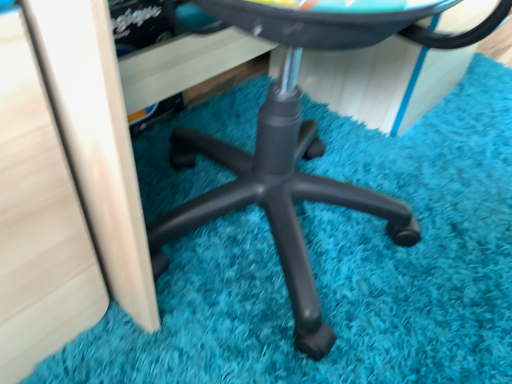
What do you see at coordinates (276, 197) in the screenshot? This screenshot has width=512, height=384. I see `black plastic chair at center` at bounding box center [276, 197].

The width and height of the screenshot is (512, 384). In order to click on black plastic chair at center in this screenshot , I will do `click(276, 197)`.

Measure the distance between black plastic chair at center and camera.

They are 14.41 inches apart.

Locate an element on the screen. The height and width of the screenshot is (384, 512). black plastic chair at center is located at coordinates (276, 197).